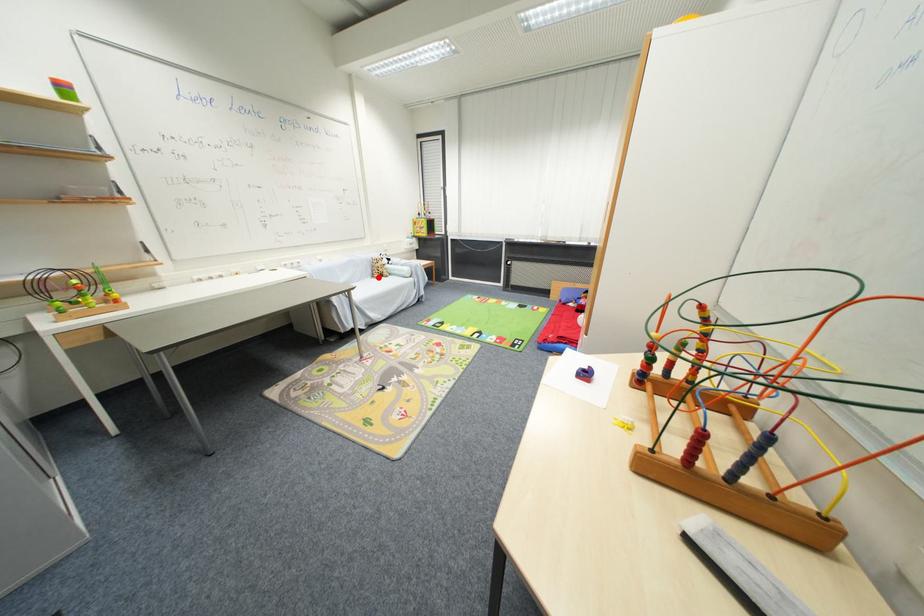
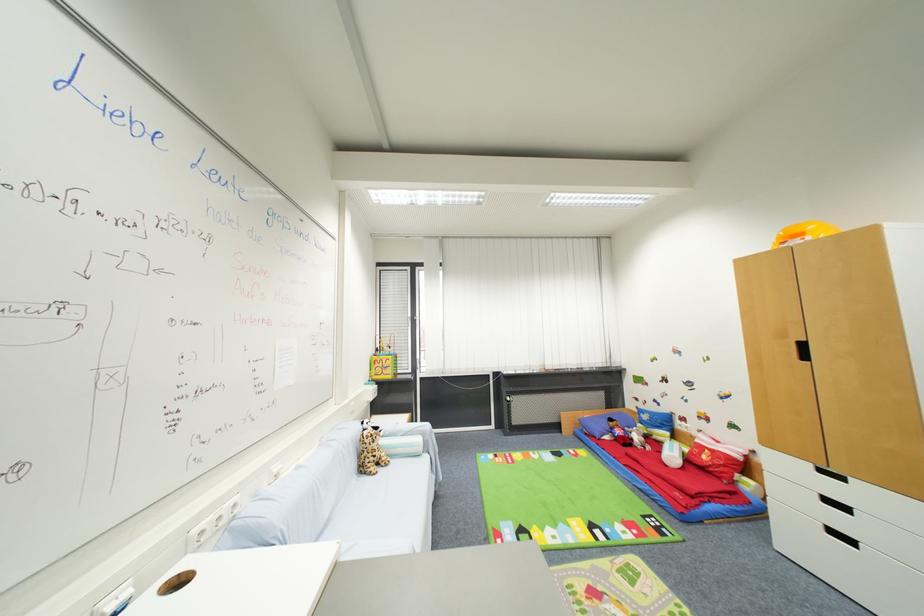
Locate, in the second image, the point that corresponds to the highlighted location in the first image.

(367, 472)